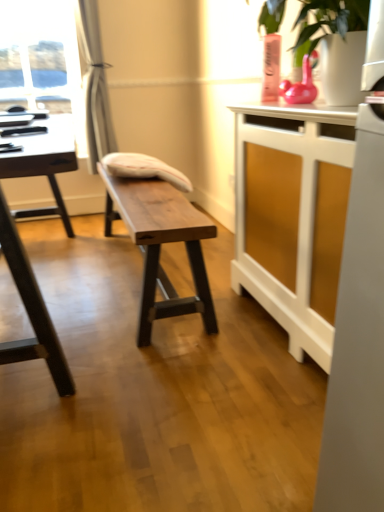
Image resolution: width=384 pixels, height=512 pixels. In order to click on free space in front of natural wood bench at center, the 2th table in the right-to-left sequence in this screenshot , I will do `click(171, 380)`.